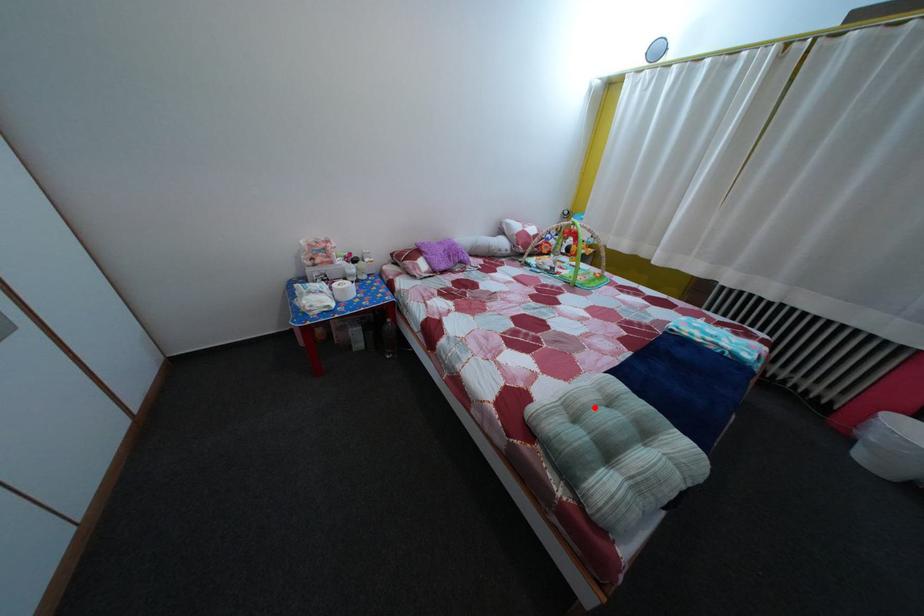
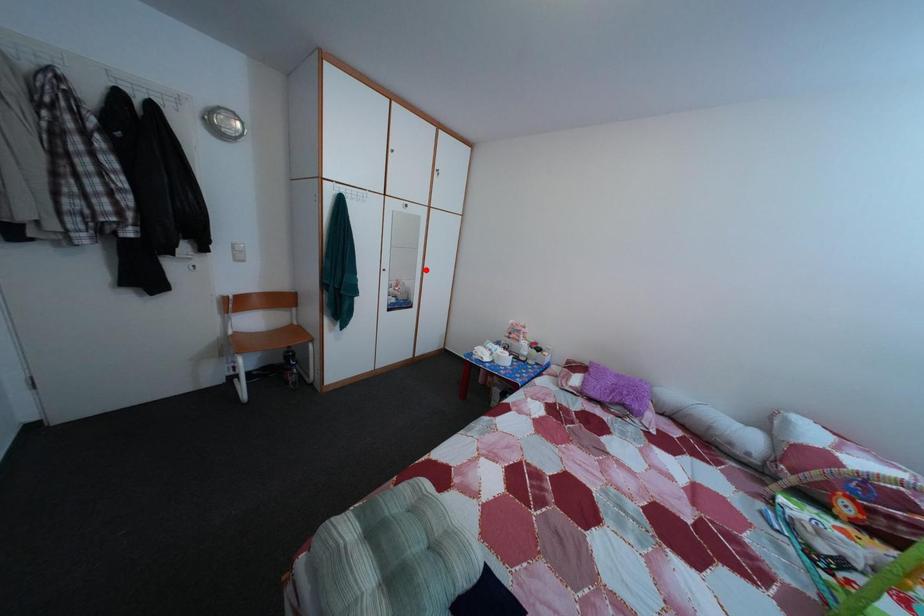
I am providing you with two images of the same scene from different viewpoints. A red point is marked on the first image and another point is marked on the second image. Are the points marked in image1 and image2 representing the same 3D position?

No